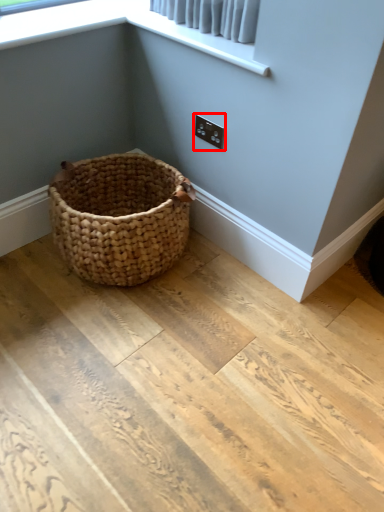
Question: Observing the image, what is the correct spatial positioning of electric outlet (annotated by the red box) in reference to window screen?

Choices:
 (A) right
 (B) left

Answer: (A)